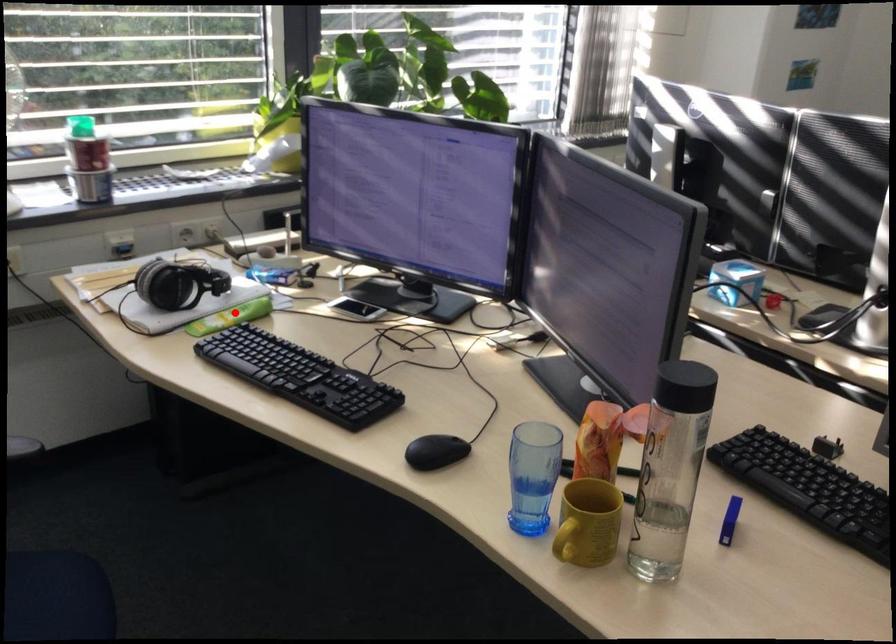
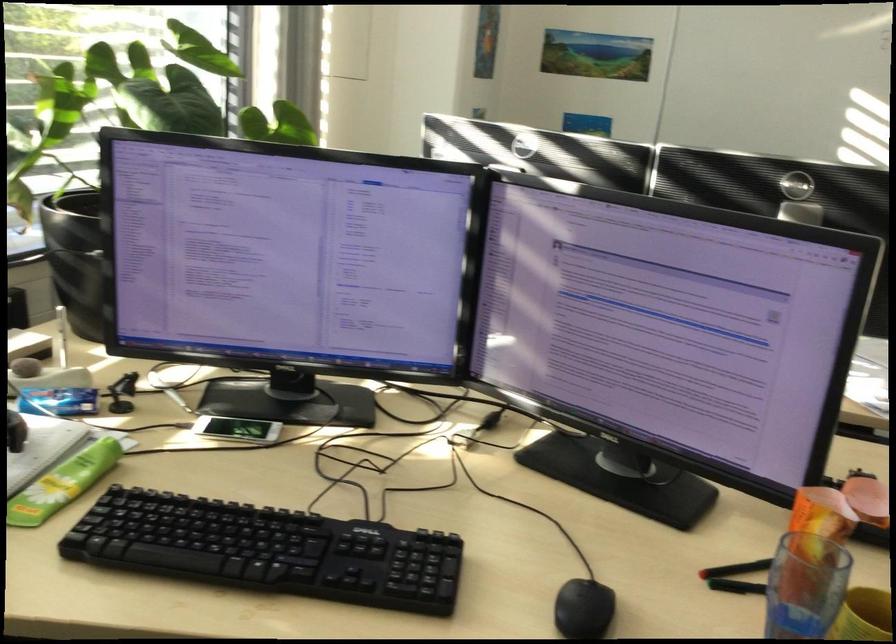
The point at the highlighted location is marked in the first image. Where is the corresponding point in the second image?

(64, 483)